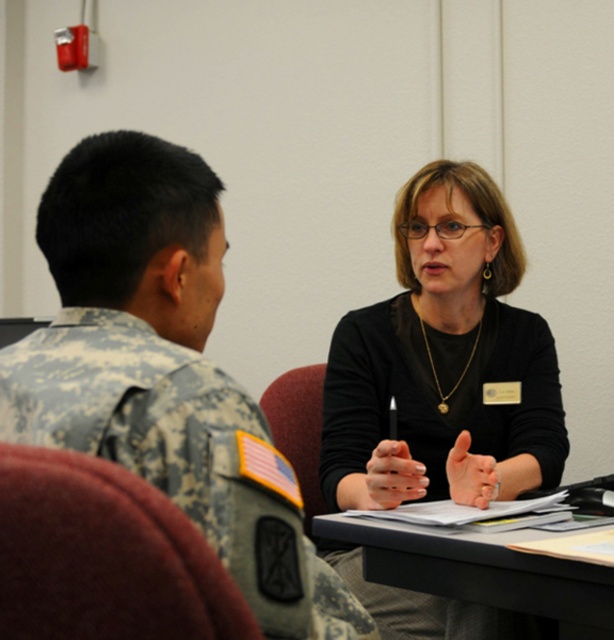
Question: Considering the relative positions of black matte shirt at center and black plastic table at center in the image provided, where is black matte shirt at center located with respect to black plastic table at center?

Choices:
 (A) right
 (B) left

Answer: (A)

Question: Which of the following is the closest to the observer?

Choices:
 (A) (421, 449)
 (B) (371, 545)
 (C) (18, 442)

Answer: (C)

Question: Does camouflage uniform at left appear on the right side of black plastic table at center?

Choices:
 (A) yes
 (B) no

Answer: (B)

Question: Can you confirm if camouflage uniform at left is positioned below black matte shirt at center?

Choices:
 (A) no
 (B) yes

Answer: (A)

Question: Which of the following is the farthest from the observer?

Choices:
 (A) (438, 212)
 (B) (564, 609)
 (C) (258, 547)

Answer: (A)

Question: Which point is closer to the camera taking this photo?

Choices:
 (A) (454, 346)
 (B) (486, 573)
 (C) (209, 419)

Answer: (C)